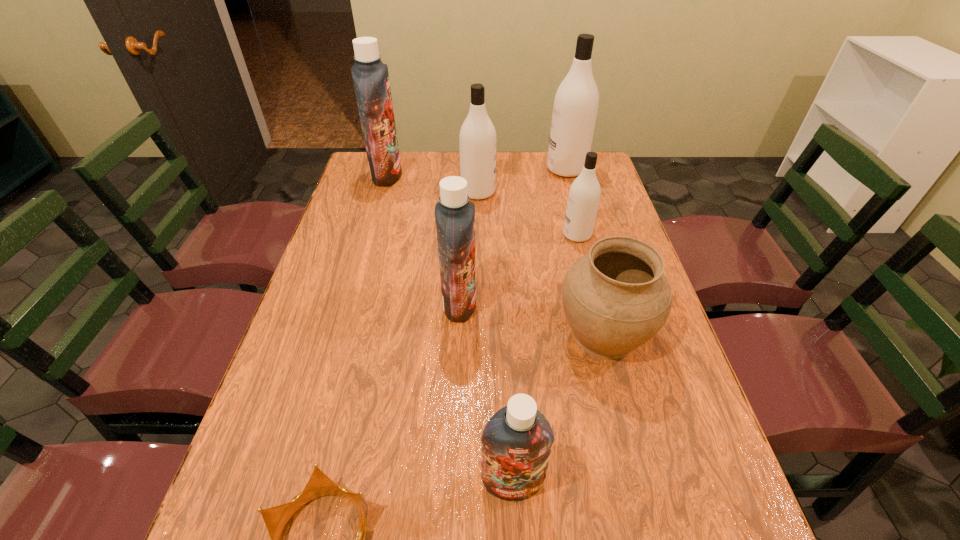
Locate an element on the screen. The height and width of the screenshot is (540, 960). vacant space at the far right corner of the desktop is located at coordinates (604, 177).

The image size is (960, 540). In order to click on empty space that is in between the leftmost white shampoo and the nearest white shampoo in this screenshot , I will do `click(528, 213)`.

Find the location of a particular element. This screenshot has height=540, width=960. free point between the second farthest blue shampoo and the farthest white shampoo is located at coordinates (513, 236).

You are a GUI agent. You are given a task and a screenshot of the screen. Output one action in this format:
    pyautogui.click(x=<x>, y=<y>)
    Task: Click on the empty space between the fifth farthest shampoo and the rightmost blue shampoo
    The width and height of the screenshot is (960, 540).
    Given the screenshot: What is the action you would take?
    pyautogui.click(x=486, y=393)

The image size is (960, 540). I want to click on vacant area between the farthest white shampoo and the second nearest white shampoo, so click(x=522, y=181).

Where is `free space between the second farthest white shampoo and the fourth farthest object`? The width and height of the screenshot is (960, 540). free space between the second farthest white shampoo and the fourth farthest object is located at coordinates (528, 213).

This screenshot has height=540, width=960. In order to click on free space between the biggest blue shampoo and the smallest white shampoo in this screenshot , I will do `click(482, 205)`.

Identify the location of free space between the second smallest blue shampoo and the biggest white shampoo. This screenshot has width=960, height=540. (513, 236).

Locate which object is the closest to the farthest white shampoo. Please provide its 2D coordinates. Your answer should be formatted as a tuple, i.e. [(x, y)], where the tuple contains the x and y coordinates of a point satisfying the conditions above.

[(477, 141)]

Where is `the fifth closest object to the urn`? The height and width of the screenshot is (540, 960). the fifth closest object to the urn is located at coordinates (477, 141).